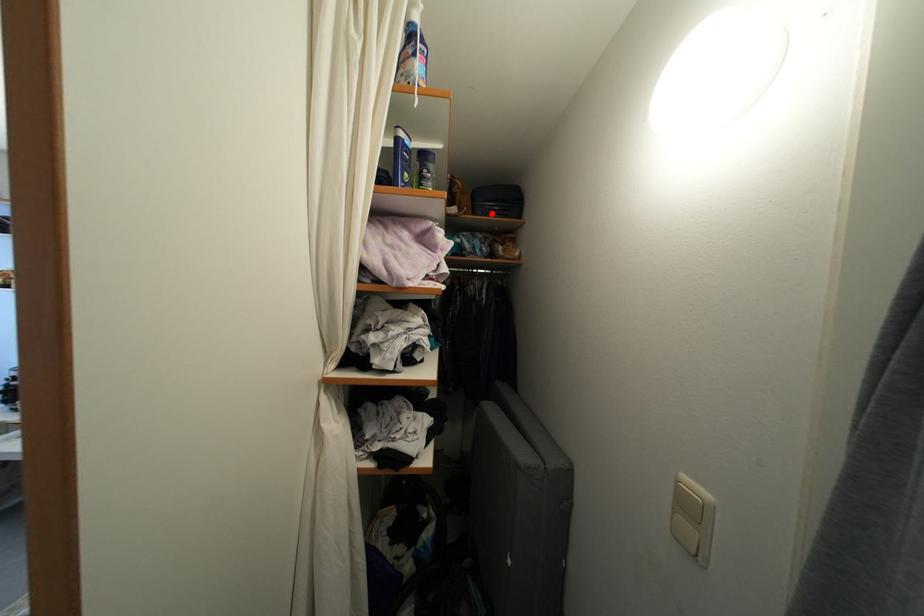
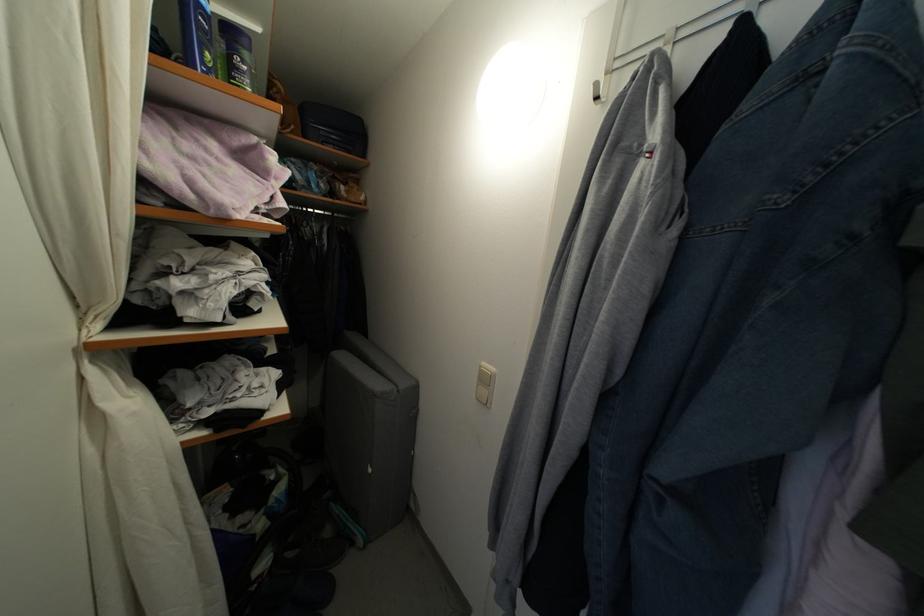
The point at the highlighted location is marked in the first image. Where is the corresponding point in the second image?

(327, 139)